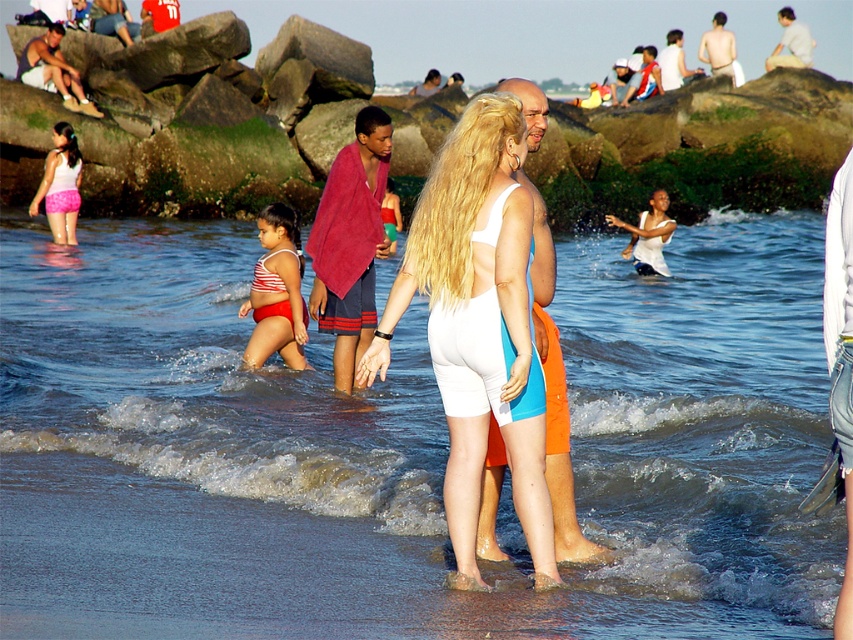
You are a photographer trying to capture a photo of the striped fabric swimsuit at center and the pink fabric shorts at left. Based on their positions, which one should you focus on first to ensure both are in frame?

The striped fabric swimsuit at center is located below the pink fabric shorts at left, so you should focus on the pink fabric shorts at left first to ensure both are in frame.

You are a beachgoer who wants to know which swimwear item is narrower between the striped fabric swimsuit at center and the pink fabric shorts at left. Can you tell me which one is thinner?

The striped fabric swimsuit at center is thinner than the pink fabric shorts at left according to the description.

You are a photographer at the beach and want to capture a photo that includes both the striped fabric swimsuit at center and the pink fabric shorts at left. Based on their positions, which one should you adjust your camera to focus on first to ensure both are in the frame?

The striped fabric swimsuit at center is positioned on the right side of pink fabric shorts at left. To include both in the frame, focus on the pink fabric shorts at left first since it is on the left, then adjust to include the striped fabric swimsuit at center on the right.